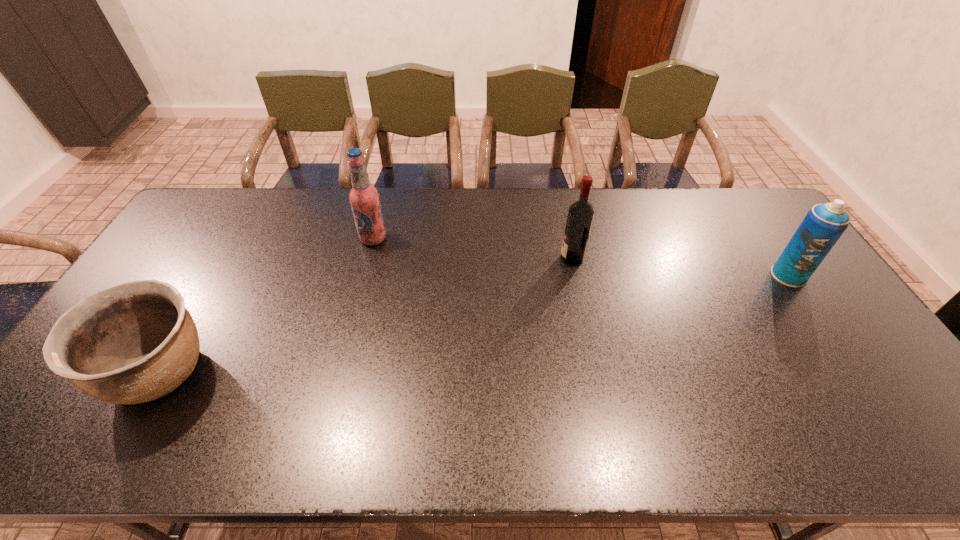
I want to click on vacant point at the right edge, so click(x=871, y=395).

Find the location of a particular element. This screenshot has height=540, width=960. vacant position at the near right corner of the desktop is located at coordinates (926, 447).

Locate an element on the screen. The width and height of the screenshot is (960, 540). vacant region between the farthest object and the pottery is located at coordinates point(268,306).

At what (x,y) coordinates should I click in order to perform the action: click on vacant area between the farther alcohol and the shortest object. Please return your answer as a coordinate pair (x, y). Image resolution: width=960 pixels, height=540 pixels. Looking at the image, I should click on (x=268, y=306).

Where is `free spot between the rightmost object and the nearer alcohol`? This screenshot has width=960, height=540. free spot between the rightmost object and the nearer alcohol is located at coordinates (680, 267).

I want to click on empty location between the right alcohol and the nearest object, so click(367, 316).

Identify the location of free space between the aerosol can and the shortest object. This screenshot has width=960, height=540. (475, 325).

This screenshot has height=540, width=960. I want to click on free point between the aerosol can and the leftmost object, so click(x=475, y=325).

Where is `vacant region between the pottery and the nearer alcohol`? Image resolution: width=960 pixels, height=540 pixels. vacant region between the pottery and the nearer alcohol is located at coordinates (367, 316).

Locate an element on the screen. The width and height of the screenshot is (960, 540). free space that is in between the third object from right to left and the right alcohol is located at coordinates (472, 248).